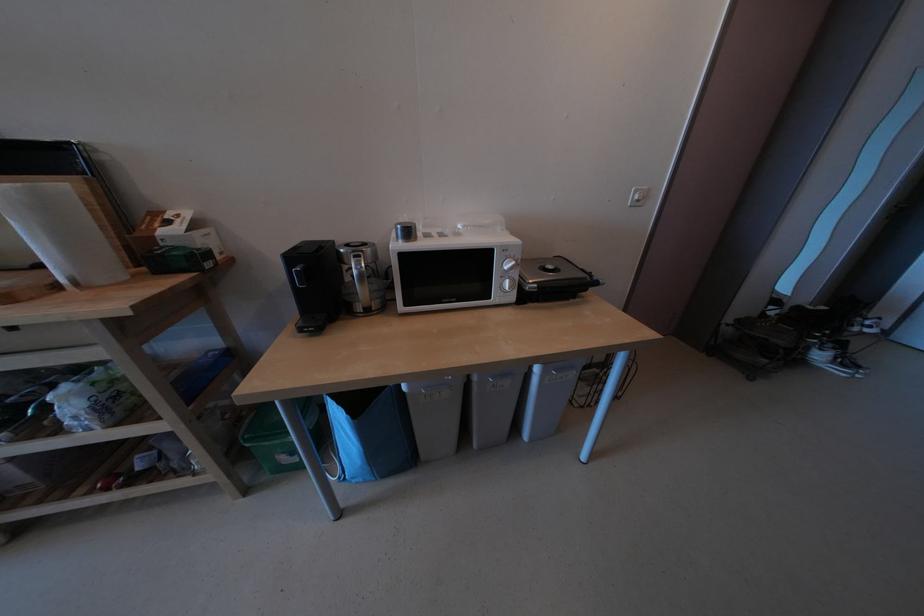
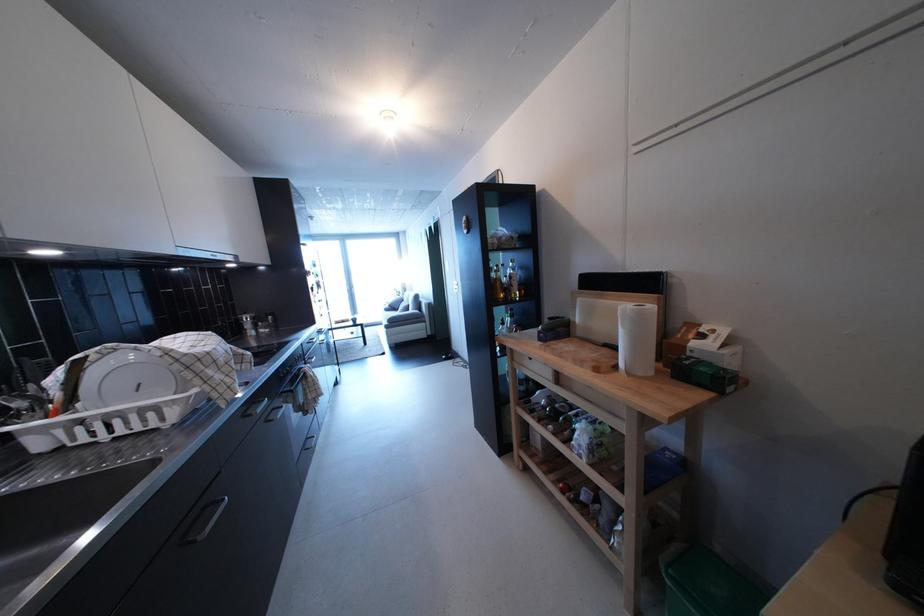
Locate, in the second image, the point that corresponds to (x=181, y=229) in the first image.

(715, 342)